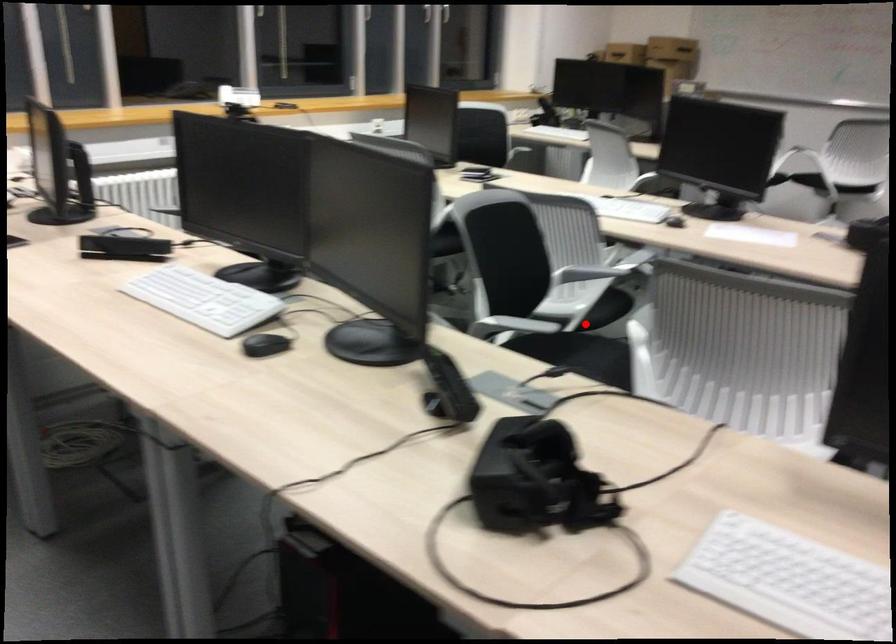
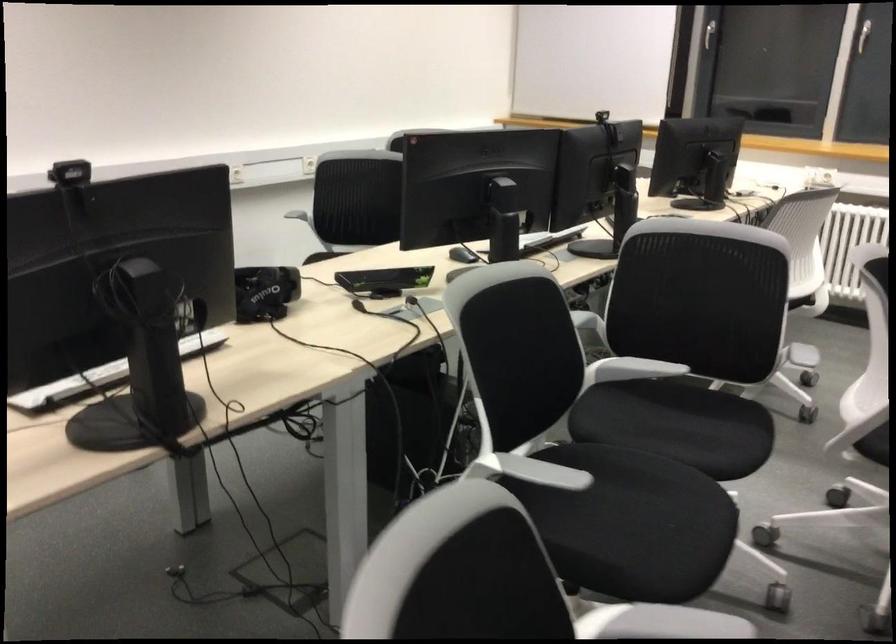
Question: I am providing you with two images of the same scene from different viewpoints. Image1 has a red point marked. In image2, the corresponding 3D location appears at what relative position? Reply with the corresponding letter.

Choices:
 (A) Closer
 (B) Farther

Answer: (A)